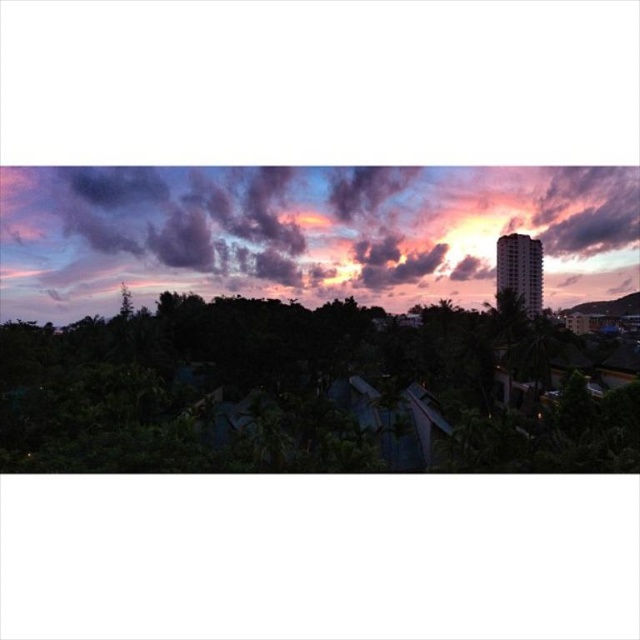
Does green leafy tree at lower left have a greater width compared to purple matte cloud at upper center?

No.

Does point (444, 365) come in front of point (225, 182)?

Yes, point (444, 365) is in front of point (225, 182).

Is point (3, 348) positioned behind point (60, 284)?

No, (3, 348) is in front of (60, 284).

Locate an element on the screen. The height and width of the screenshot is (640, 640). green leafy tree at lower left is located at coordinates (301, 392).